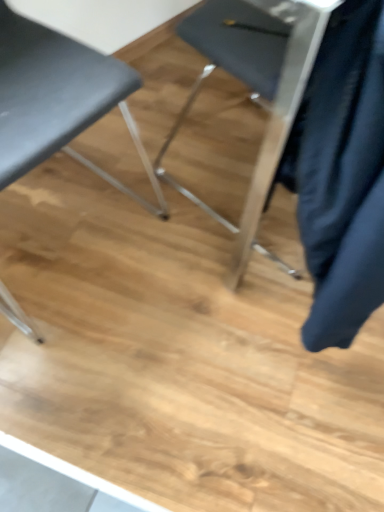
In order to click on matte black chair at center, arranged as the second chair when viewed from the left in this screenshot , I will do `click(255, 88)`.

The height and width of the screenshot is (512, 384). What do you see at coordinates (255, 88) in the screenshot? I see `matte black chair at center, the first chair from the right` at bounding box center [255, 88].

Describe the element at coordinates (58, 99) in the screenshot. Image resolution: width=384 pixels, height=512 pixels. I see `matte black chair at left, the second chair positioned from the right` at that location.

Measure the distance between point (63,64) and camera.

Point (63,64) and camera are 31.85 inches apart from each other.

Identify the location of matte black chair at left, the second chair positioned from the right. The width and height of the screenshot is (384, 512). (58, 99).

The height and width of the screenshot is (512, 384). I want to click on matte black chair at center, the first chair from the right, so click(255, 88).

Considering the positions of objects matte black chair at center, the first chair from the right, and matte black chair at left, the second chair positioned from the right, in the image provided, who is more to the left, matte black chair at center, the first chair from the right, or matte black chair at left, the second chair positioned from the right,?

Positioned to the left is matte black chair at left, the second chair positioned from the right.

Which object is closer to the camera, matte black chair at center, the first chair from the right, or matte black chair at left, the first chair in the left-to-right sequence?

matte black chair at left, the first chair in the left-to-right sequence.

Does point (325, 20) lie in front of point (16, 49)?

Yes, it is in front of point (16, 49).

From the image's perspective, is matte black chair at center, arranged as the second chair when viewed from the left, located beneath matte black chair at left, the first chair in the left-to-right sequence?

No, from the image's perspective, matte black chair at center, arranged as the second chair when viewed from the left, is not below matte black chair at left, the first chair in the left-to-right sequence.

From a real-world perspective, which is physically below, matte black chair at center, arranged as the second chair when viewed from the left, or matte black chair at left, the second chair positioned from the right?

matte black chair at center, arranged as the second chair when viewed from the left, is physically lower.

Between matte black chair at center, the first chair from the right, and matte black chair at left, the first chair in the left-to-right sequence, which one has smaller width?

With smaller width is matte black chair at center, the first chair from the right.

Is matte black chair at center, arranged as the second chair when viewed from the left, shorter than matte black chair at left, the first chair in the left-to-right sequence?

Correct, matte black chair at center, arranged as the second chair when viewed from the left, is not as tall as matte black chair at left, the first chair in the left-to-right sequence.

Between matte black chair at center, the first chair from the right, and matte black chair at left, the first chair in the left-to-right sequence, which one has smaller size?

matte black chair at center, the first chair from the right, is smaller.

Does matte black chair at center, arranged as the second chair when viewed from the left, contain matte black chair at left, the first chair in the left-to-right sequence?

Actually, matte black chair at left, the first chair in the left-to-right sequence, is outside matte black chair at center, arranged as the second chair when viewed from the left.

Is matte black chair at center, arranged as the second chair when viewed from the left, positioned far away from matte black chair at left, the first chair in the left-to-right sequence?

That's not correct — matte black chair at center, arranged as the second chair when viewed from the left, is a little close to matte black chair at left, the first chair in the left-to-right sequence.

Is matte black chair at center, arranged as the second chair when viewed from the left, oriented away from matte black chair at left, the second chair positioned from the right?

No.

How different are the orientations of matte black chair at center, the first chair from the right, and matte black chair at left, the first chair in the left-to-right sequence, in degrees?

The angular difference between matte black chair at center, the first chair from the right, and matte black chair at left, the first chair in the left-to-right sequence, is 176 degrees.

This screenshot has height=512, width=384. In order to click on chair behind the matte black chair at left, the first chair in the left-to-right sequence in this screenshot , I will do `click(255, 88)`.

Does matte black chair at left, the second chair positioned from the right, appear on the left side of matte black chair at center, arranged as the second chair when viewed from the left?

Yes.

Which object is further away from the camera taking this photo, matte black chair at left, the first chair in the left-to-right sequence, or matte black chair at center, the first chair from the right?

matte black chair at center, the first chair from the right, is further away from the camera.

Is point (117, 99) positioned in front of point (292, 119)?

No, it is behind (292, 119).

From the image's perspective, which one is positioned lower, matte black chair at left, the second chair positioned from the right, or matte black chair at center, arranged as the second chair when viewed from the left?

matte black chair at left, the second chair positioned from the right, from the image's perspective.

From a real-world perspective, relative to matte black chair at center, arranged as the second chair when viewed from the left, is matte black chair at left, the first chair in the left-to-right sequence, vertically above or below?

matte black chair at left, the first chair in the left-to-right sequence, is situated higher than matte black chair at center, arranged as the second chair when viewed from the left, in the real world.

Considering the sizes of objects matte black chair at left, the first chair in the left-to-right sequence, and matte black chair at center, arranged as the second chair when viewed from the left, in the image provided, who is thinner, matte black chair at left, the first chair in the left-to-right sequence, or matte black chair at center, arranged as the second chair when viewed from the left,?

matte black chair at center, arranged as the second chair when viewed from the left, is thinner.

Can you confirm if matte black chair at left, the second chair positioned from the right, is taller than matte black chair at center, arranged as the second chair when viewed from the left?

Yes.

Who is smaller, matte black chair at left, the first chair in the left-to-right sequence, or matte black chair at center, arranged as the second chair when viewed from the left?

With smaller size is matte black chair at center, arranged as the second chair when viewed from the left.

Is matte black chair at left, the second chair positioned from the right, not within matte black chair at center, the first chair from the right?

Yes, matte black chair at left, the second chair positioned from the right, is outside of matte black chair at center, the first chair from the right.

Would you consider matte black chair at left, the first chair in the left-to-right sequence, to be distant from matte black chair at center, the first chair from the right?

matte black chair at left, the first chair in the left-to-right sequence, is actually quite close to matte black chair at center, the first chair from the right.

Does matte black chair at left, the second chair positioned from the right, turn towards matte black chair at center, the first chair from the right?

No.

Measure the distance from matte black chair at left, the first chair in the left-to-right sequence, to matte black chair at center, arranged as the second chair when viewed from the left.

matte black chair at left, the first chair in the left-to-right sequence, and matte black chair at center, arranged as the second chair when viewed from the left, are 15.49 inches apart.

Locate an element on the screen. This screenshot has height=512, width=384. chair above the matte black chair at left, the first chair in the left-to-right sequence (from the image's perspective) is located at coordinates (255, 88).

In order to click on chair in front of the matte black chair at center, arranged as the second chair when viewed from the left in this screenshot , I will do `click(58, 99)`.

I want to click on chair on the left of matte black chair at center, the first chair from the right, so click(58, 99).